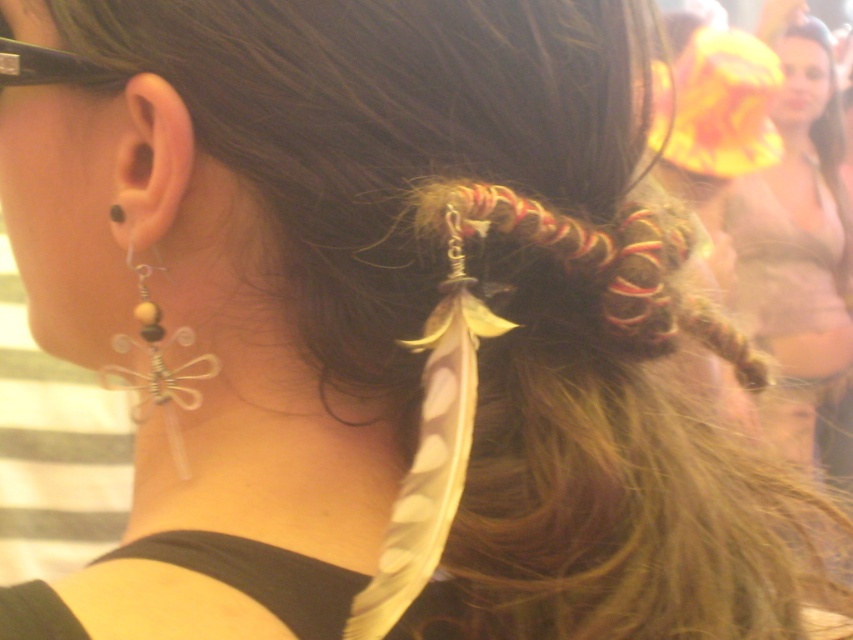
Can you confirm if matte gold hair at upper right is taller than clear plastic dragonfly at ear?

Correct, matte gold hair at upper right is much taller as clear plastic dragonfly at ear.

From the picture: Does matte gold hair at upper right lie behind clear plastic dragonfly at ear?

Yes, it is behind clear plastic dragonfly at ear.

At what (x,y) coordinates should I click in order to perform the action: click on matte gold hair at upper right. Please return your answer as a coordinate pair (x, y). Image resolution: width=853 pixels, height=640 pixels. Looking at the image, I should click on (799, 240).

This screenshot has height=640, width=853. In order to click on matte gold hair at upper right in this screenshot , I will do `click(799, 240)`.